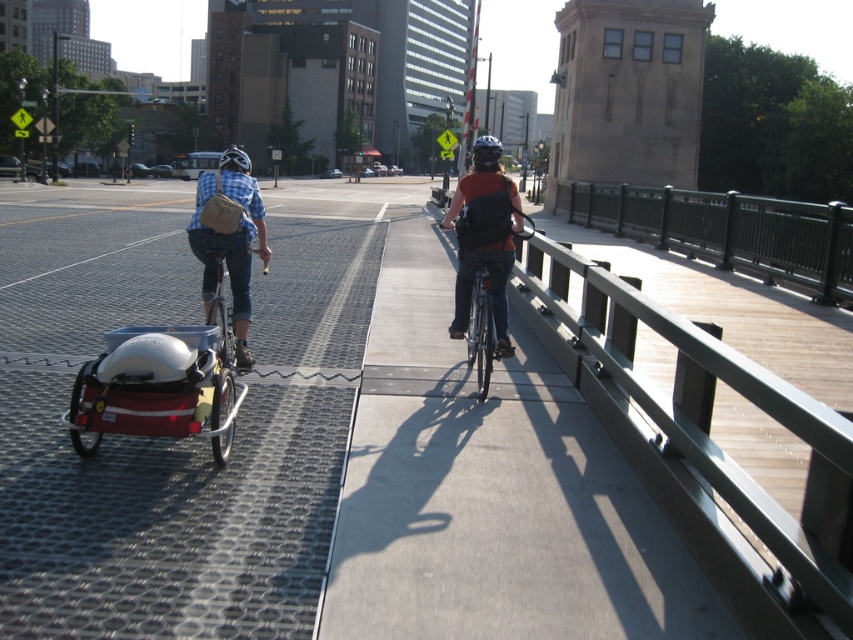
Which is in front, point (444, 216) or point (221, 163)?

Point (221, 163) is in front.

Where is `matte black bicycle at center`? matte black bicycle at center is located at coordinates (480, 330).

Does blue plaid shirt at center have a lesser width compared to matte black helmet at upper center?

Yes.

Does blue plaid shirt at center appear under matte black helmet at upper center?

Yes.

You are a GUI agent. You are given a task and a screenshot of the screen. Output one action in this format:
    pyautogui.click(x=<x>, y=<y>)
    Task: Click on the blue plaid shirt at center
    The image size is (853, 640).
    Given the screenshot: What is the action you would take?
    pyautogui.click(x=229, y=244)

Who is positioned more to the right, blue plaid shirt at center or black matte helmet at center?

black matte helmet at center is more to the right.

Does blue plaid shirt at center have a greater height compared to black matte helmet at center?

No.

Where is `blue plaid shirt at center`? blue plaid shirt at center is located at coordinates (229, 244).